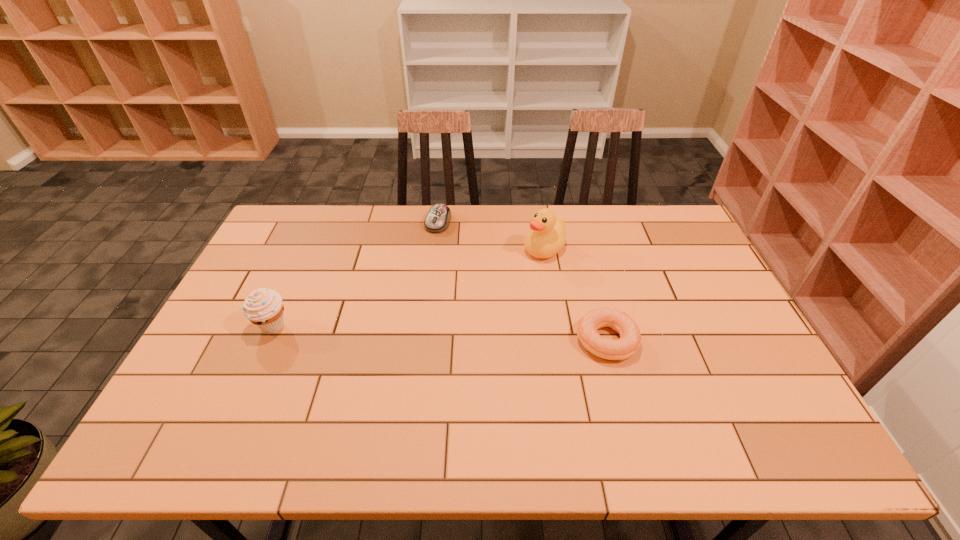
At what (x,y) coordinates should I click in order to perform the action: click on free space on the desktop that is between the muffin and the bagel and is positioned at the beak of the duck. Please return your answer as a coordinate pair (x, y). Looking at the image, I should click on (412, 332).

The image size is (960, 540). I want to click on vacant spot on the desktop that is between the muffin and the bagel and is positioned on the wheel side of the farthest object, so click(389, 331).